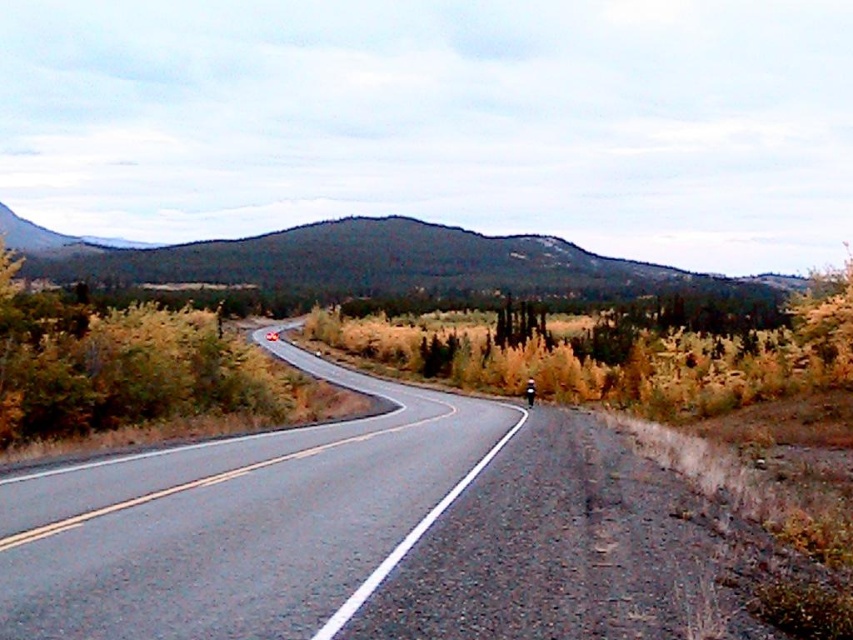
Who is positioned more to the left, asphalt road at center or green forested mountain at upper center?

green forested mountain at upper center is more to the left.

Is asphalt road at center further to camera compared to green forested mountain at upper center?

No.

Is point (120, 520) farther from viewer compared to point (323, 268)?

No.

The image size is (853, 640). I want to click on asphalt road at center, so click(241, 522).

Between asphalt road at center and green leafy shrub at left, which one has less height?

With less height is asphalt road at center.

Does point (57, 628) come behind point (1, 296)?

No, it is in front of (1, 296).

Locate an element on the screen. asphalt road at center is located at coordinates (241, 522).

Is the position of green forested mountain at upper center less distant than that of green leafy shrub at left?

No.

Does green forested mountain at upper center appear on the left side of green leafy shrub at left?

No, green forested mountain at upper center is not to the left of green leafy shrub at left.

Which is behind, point (294, 269) or point (201, 385)?

The point (294, 269) is more distant.

The image size is (853, 640). What are the coordinates of `green forested mountain at upper center` in the screenshot? It's located at (373, 262).